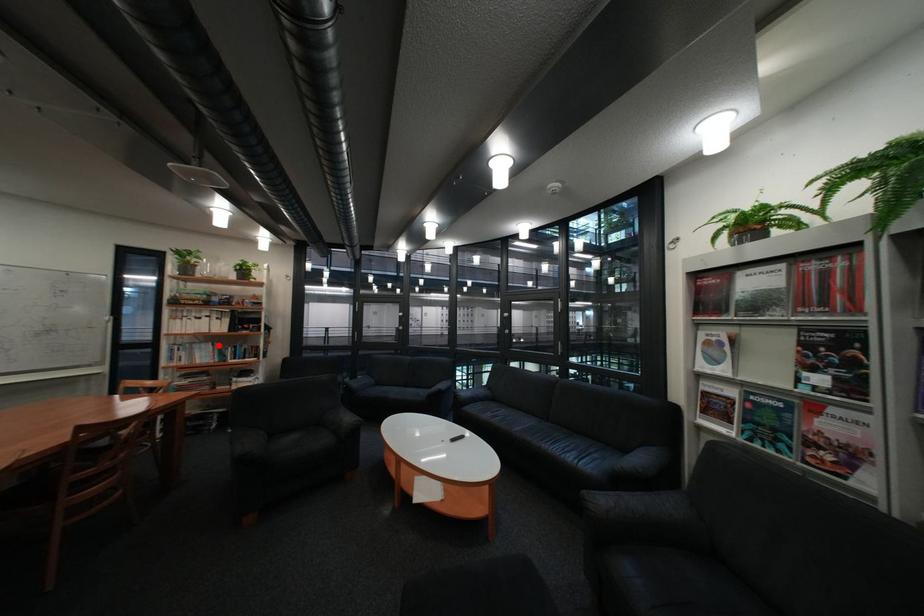
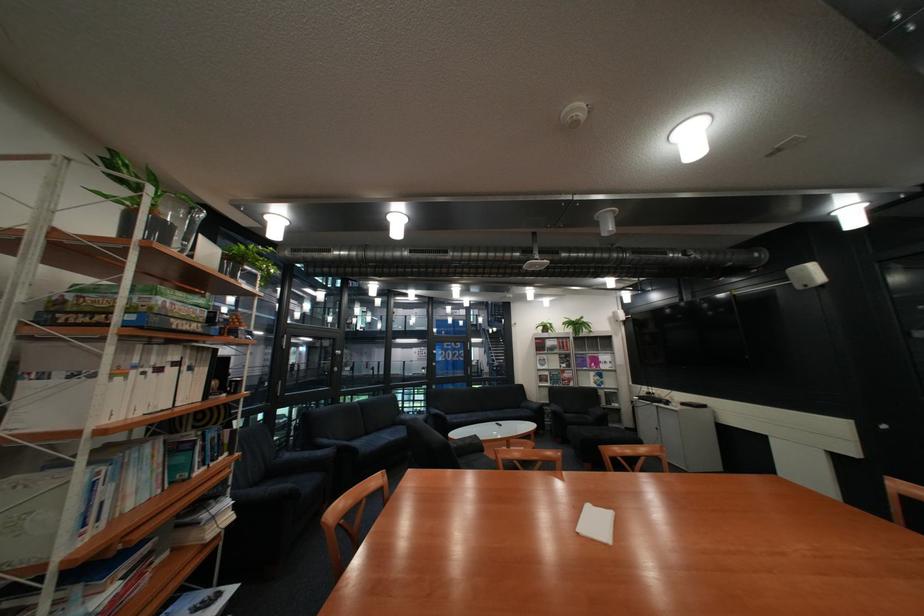
Locate, in the second image, the point that corresponds to the highlighted location in the first image.

(163, 448)